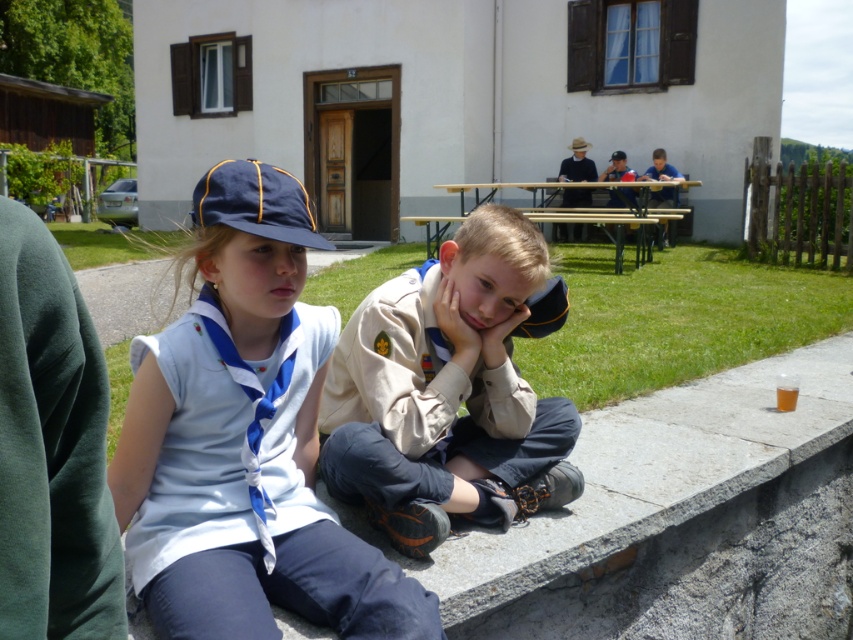
Which of these two, white cotton shirt at center or wooden picnic table at center, stands shorter?

Standing shorter between the two is white cotton shirt at center.

Can you confirm if white cotton shirt at center is positioned to the left of wooden picnic table at center?

Indeed, white cotton shirt at center is positioned on the left side of wooden picnic table at center.

Does point (239, 307) come behind point (590, 216)?

No, it is not.

The width and height of the screenshot is (853, 640). In order to click on white cotton shirt at center in this screenshot , I will do `click(245, 440)`.

Is tan fabric uniform at center closer to the viewer compared to wooden picnic table at center?

Yes, it is.

Which is in front, point (505, 328) or point (444, 230)?

Point (505, 328)

This screenshot has height=640, width=853. I want to click on tan fabric uniform at center, so click(x=445, y=392).

Can you confirm if white cotton shirt at center is positioned to the right of tan fabric uniform at center?

In fact, white cotton shirt at center is to the left of tan fabric uniform at center.

Which is above, white cotton shirt at center or tan fabric uniform at center?

white cotton shirt at center is above.

Where is `white cotton shirt at center`? white cotton shirt at center is located at coordinates (245, 440).

The image size is (853, 640). Find the location of `white cotton shirt at center`. white cotton shirt at center is located at coordinates (245, 440).